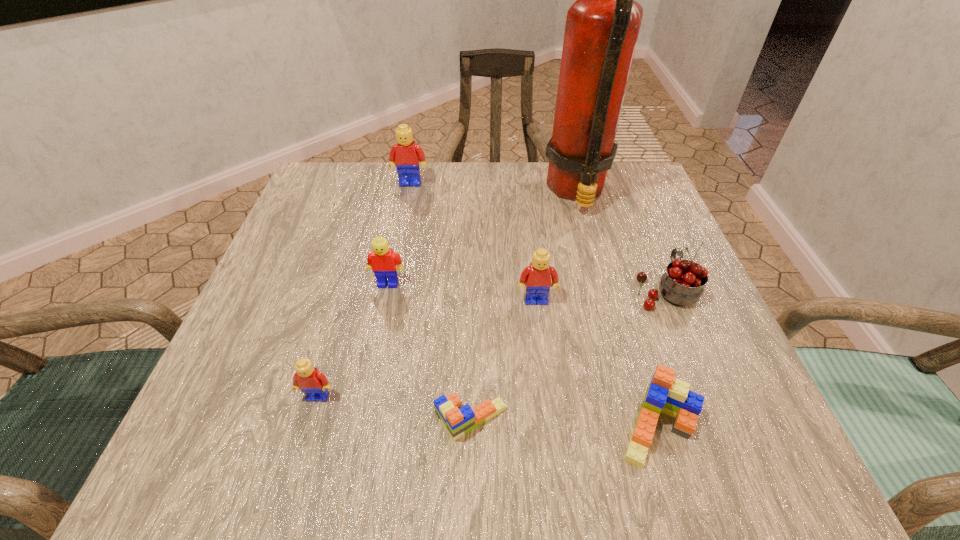
Locate an element on the screen. the rightmost Lego is located at coordinates (665, 394).

Find the location of a particular element. the second shortest object is located at coordinates (665, 394).

Locate an element on the screen. the third Lego from right to left is located at coordinates (458, 420).

Find the location of a particular element. the left orange Lego is located at coordinates (458, 420).

Where is `vacant space located 0.370m at the nozzle of the red fire extinguisher`? vacant space located 0.370m at the nozzle of the red fire extinguisher is located at coordinates (388, 192).

At what (x,y) coordinates should I click in order to perform the action: click on vacant area located 0.400m at the nozzle of the red fire extinguisher. Please return your answer as a coordinate pair (x, y). Looking at the image, I should click on (375, 192).

Locate an element on the screen. This screenshot has height=540, width=960. blank space located 0.210m at the nozzle of the red fire extinguisher is located at coordinates [x=455, y=192].

Where is `free region located on the front-facing side of the farthest Lego`? free region located on the front-facing side of the farthest Lego is located at coordinates (407, 200).

Locate an element on the screen. vacant region located on the front-facing side of the third farthest Lego is located at coordinates (x=541, y=347).

In order to click on free point located on the front-facing side of the second farthest Lego in this screenshot , I will do `click(372, 360)`.